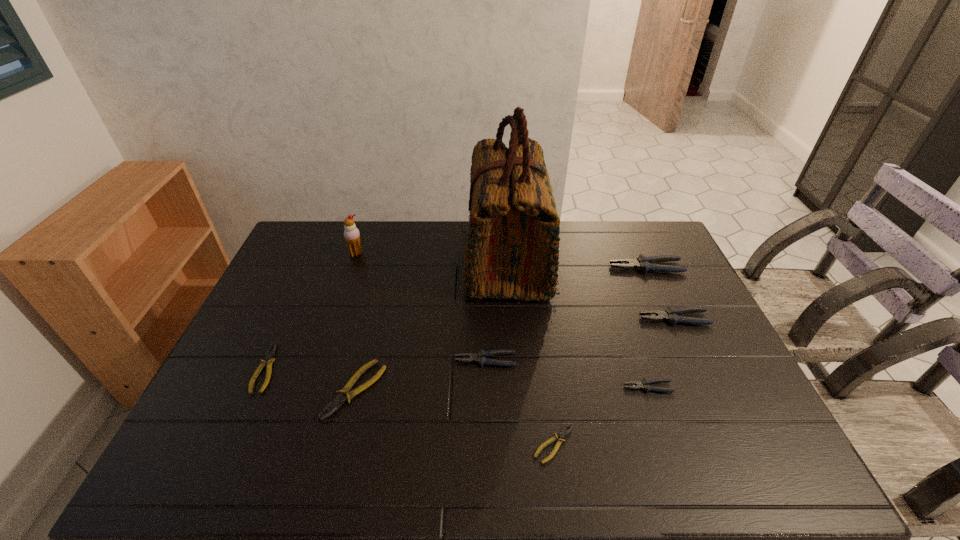
I want to click on vacant region between the sixth nearest pliers and the shortest pliers, so click(x=614, y=381).

The height and width of the screenshot is (540, 960). Find the location of `vacant area that lies between the fifth shortest pliers and the icecream`. vacant area that lies between the fifth shortest pliers and the icecream is located at coordinates (420, 307).

Where is `blank region between the sixth nearest object and the shortest object`? Image resolution: width=960 pixels, height=540 pixels. blank region between the sixth nearest object and the shortest object is located at coordinates (614, 381).

The width and height of the screenshot is (960, 540). I want to click on free space between the tallest object and the nearest object, so point(531,352).

The image size is (960, 540). In order to click on free spot between the eighth shortest object and the nearest gray pliers in this screenshot , I will do `click(502, 320)`.

Locate an element on the screen. The image size is (960, 540). object that ranks as the seventh closest to the second smallest gray pliers is located at coordinates (268, 359).

The width and height of the screenshot is (960, 540). Find the location of `object that can be found as the closest to the farthest gray pliers`. object that can be found as the closest to the farthest gray pliers is located at coordinates (670, 314).

The width and height of the screenshot is (960, 540). I want to click on pliers that is the second nearest to the fifth shortest object, so click(343, 395).

Identify the location of pliers that is the fifth closest to the second yellow pliers from left to right. (670, 314).

This screenshot has width=960, height=540. In order to click on gray pliers that is the second closest to the farthest pliers in this screenshot , I will do `click(644, 384)`.